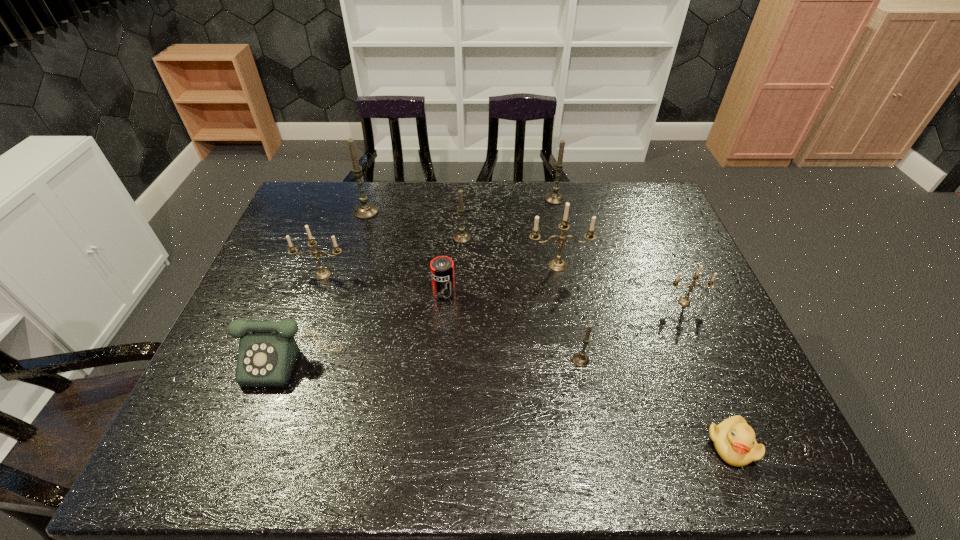
This screenshot has width=960, height=540. I want to click on free spot located 0.240m on the left of the nearest gray candle, so click(473, 360).

Locate an element on the screen. This screenshot has height=540, width=960. vacant space located 0.160m on the back of the rightmost candle is located at coordinates (665, 258).

At what (x,y) coordinates should I click in order to perform the action: click on free space located on the front of the can. Please return your answer as a coordinate pair (x, y). The height and width of the screenshot is (540, 960). Looking at the image, I should click on (438, 378).

Where is `free spot located 0.130m on the dial of the telephone`? free spot located 0.130m on the dial of the telephone is located at coordinates (260, 444).

Image resolution: width=960 pixels, height=540 pixels. I want to click on object situated at the near edge, so click(x=734, y=440).

Image resolution: width=960 pixels, height=540 pixels. In order to click on candle that is at the left edge in this screenshot , I will do `click(322, 274)`.

I want to click on telephone present at the left edge, so click(267, 354).

At what (x,y) coordinates should I click in order to perform the action: click on candle that is positioned at the right edge. Please return your answer as a coordinate pair (x, y). Looking at the image, I should click on (685, 301).

This screenshot has width=960, height=540. I want to click on duckling that is at the right edge, so click(x=734, y=440).

At what (x,y) coordinates should I click in order to perform the action: click on object that is positioned at the near right corner. Please return your answer as a coordinate pair (x, y). Looking at the image, I should click on (734, 440).